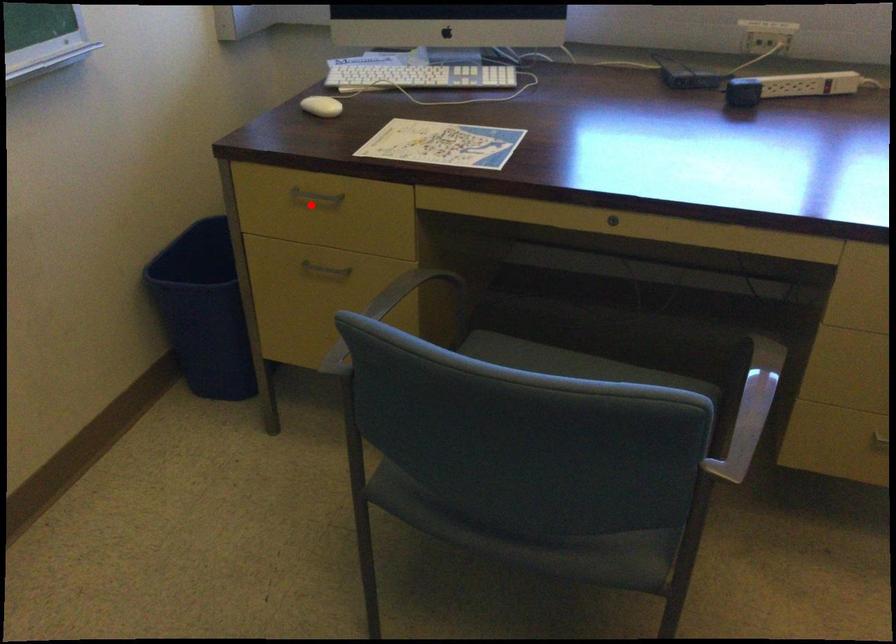
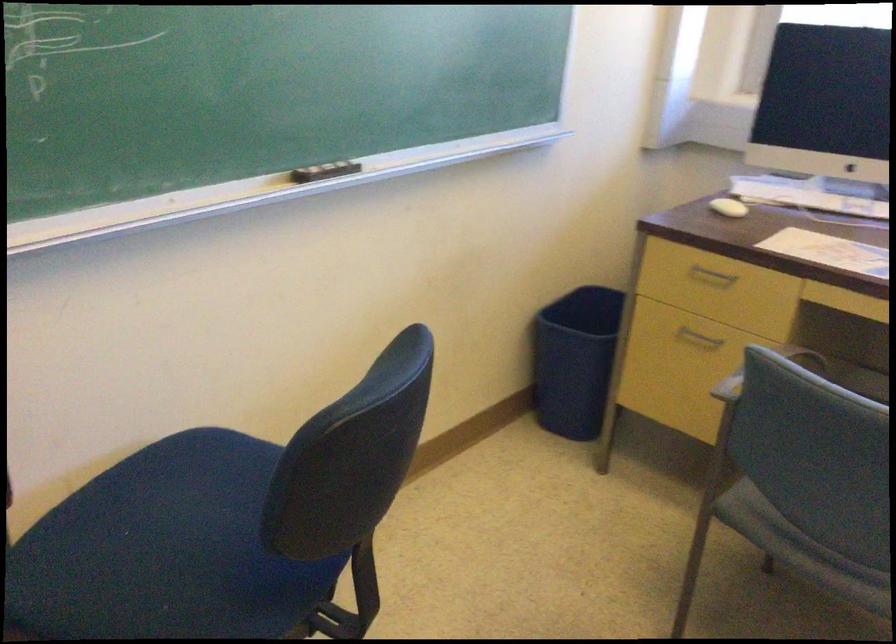
Locate, in the second image, the point that corresponds to the highlighted location in the first image.

(711, 277)